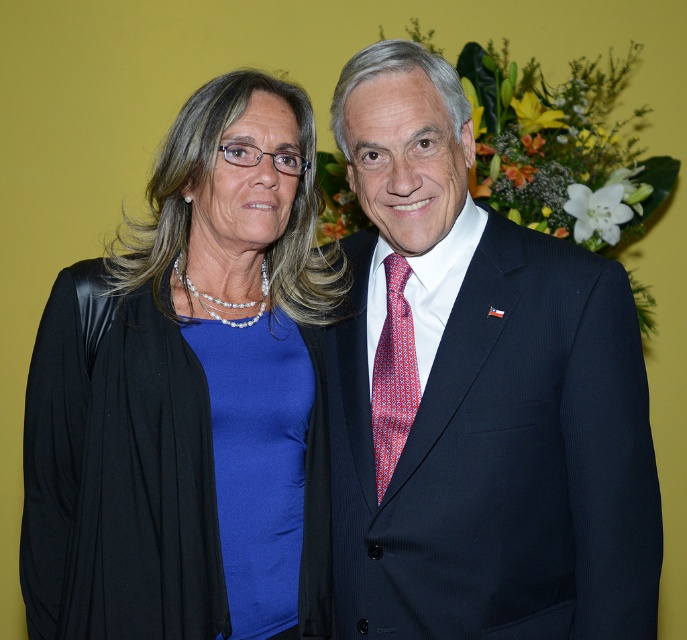
Is dark blue suit at center below matte blue dress at center?

Actually, dark blue suit at center is above matte blue dress at center.

Is point (429, 253) positioned in front of point (271, 330)?

That is True.

The image size is (687, 640). I want to click on dark blue suit at center, so click(477, 394).

Is matte black blazer at left thinner than matte blue dress at center?

No.

Between matte black blazer at left and matte blue dress at center, which one appears on the right side from the viewer's perspective?

matte blue dress at center is more to the right.

Image resolution: width=687 pixels, height=640 pixels. Describe the element at coordinates (191, 397) in the screenshot. I see `matte black blazer at left` at that location.

At what (x,y) coordinates should I click in order to perform the action: click on matte black blazer at left. Please return your answer as a coordinate pair (x, y). The image size is (687, 640). Looking at the image, I should click on (191, 397).

Which is in front, point (583, 349) or point (313, 145)?

Point (583, 349) is more forward.

Between dark blue suit at center and matte black blazer at left, which one is positioned lower?

matte black blazer at left

Between point (532, 394) and point (183, 209), which one is positioned in front?

Positioned in front is point (532, 394).

Locate an element on the screen. dark blue suit at center is located at coordinates (477, 394).